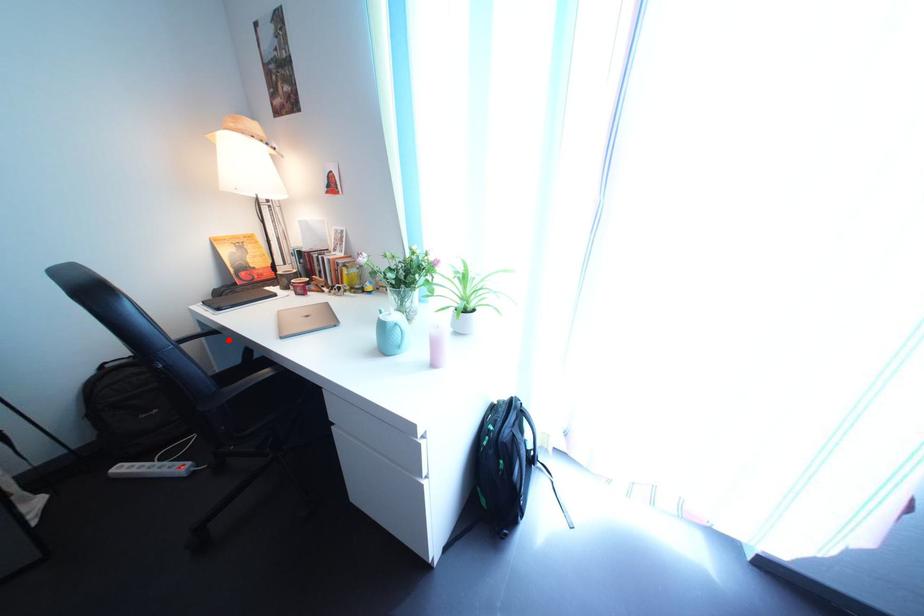
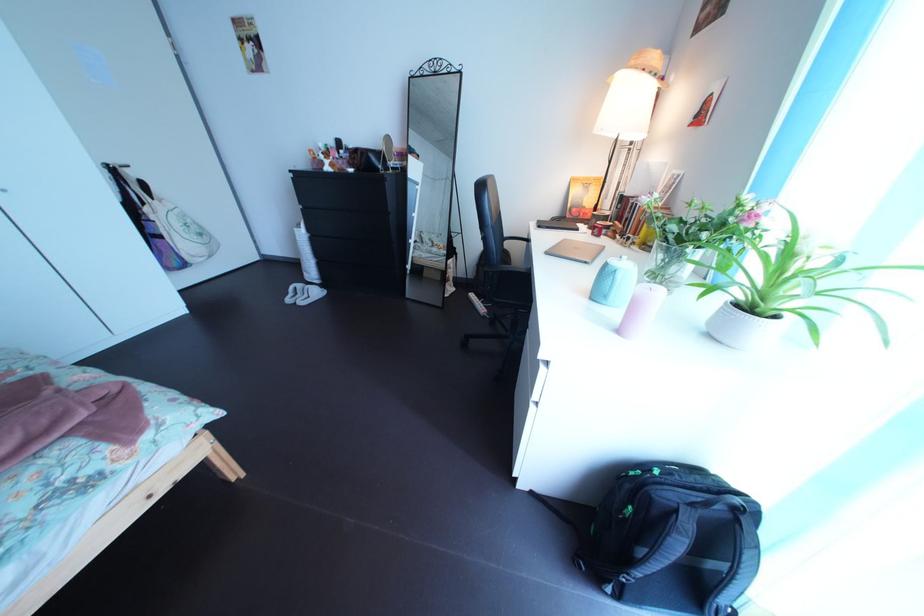
Where in the second image is the point corresponding to the highlighted location from the first image?

(541, 248)